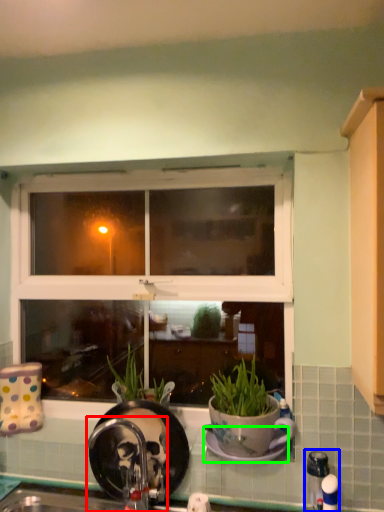
Question: Which object is the closest to the faucet (highlighted by a red box)? Choose among these: faucet (highlighted by a blue box) or plate (highlighted by a green box).

Choices:
 (A) faucet
 (B) plate

Answer: (B)